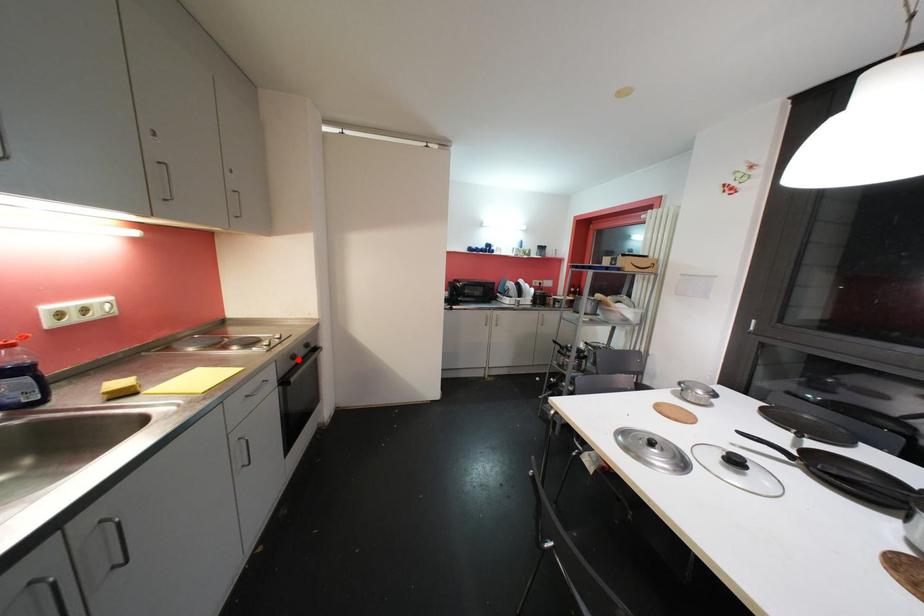
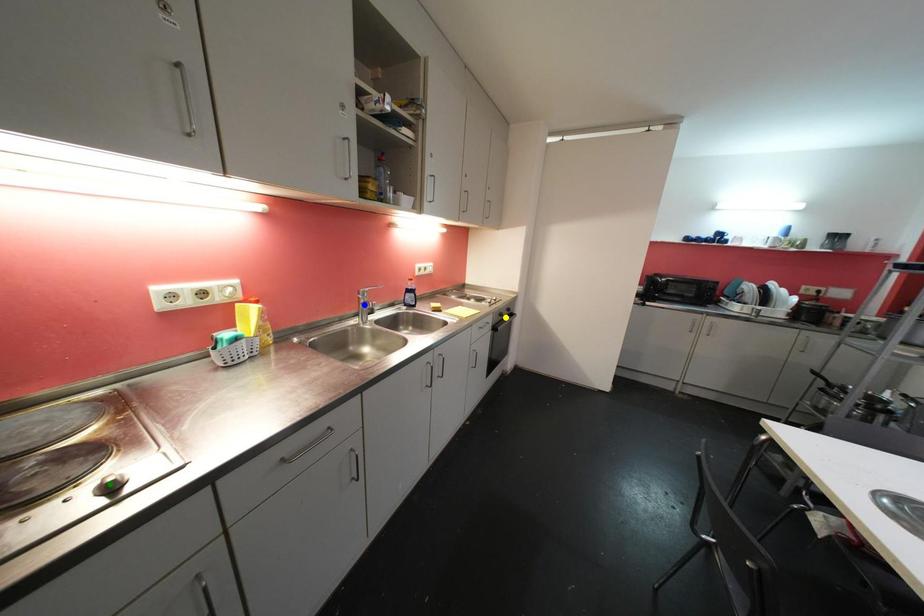
Question: I am providing you with two images of the same scene from different viewpoints. A red point is marked on the first image. You are given multiple points on the second image. Which mark in image 2 goes with the point in image 1?

Choices:
 (A) yellow point
 (B) blue point
 (C) green point

Answer: (A)